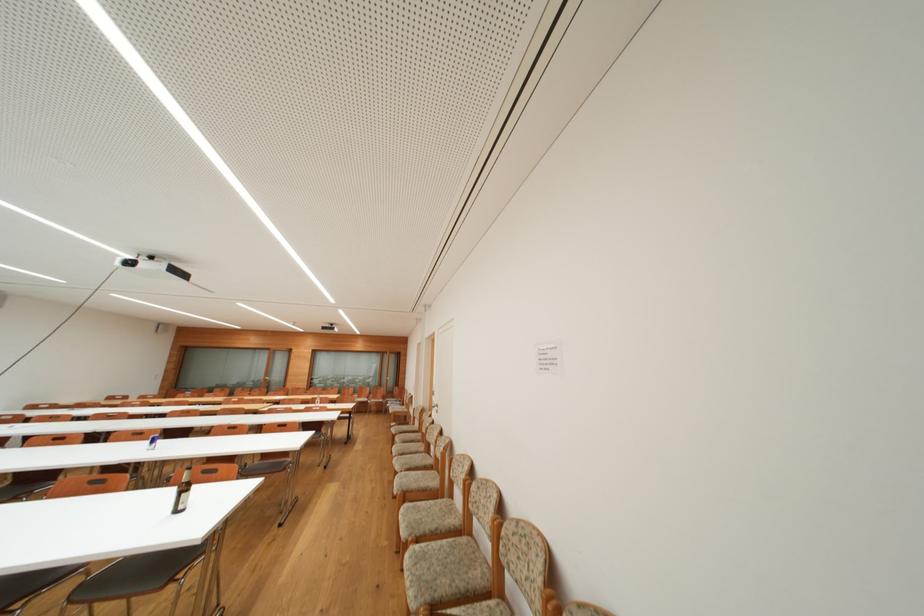
Find the location of a particular element. silver door handle is located at coordinates (434, 407).